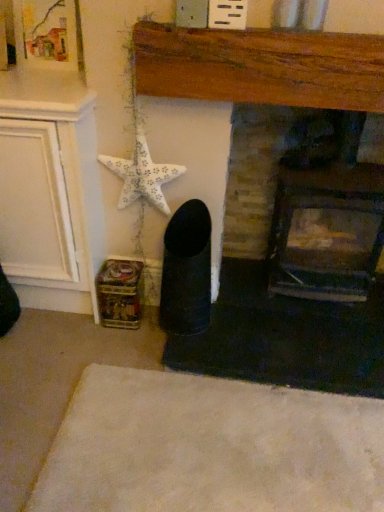
Where is `free space in front of dark brick fireplace at center, the 2th fireplace when ordered from left to right`? The width and height of the screenshot is (384, 512). free space in front of dark brick fireplace at center, the 2th fireplace when ordered from left to right is located at coordinates (312, 349).